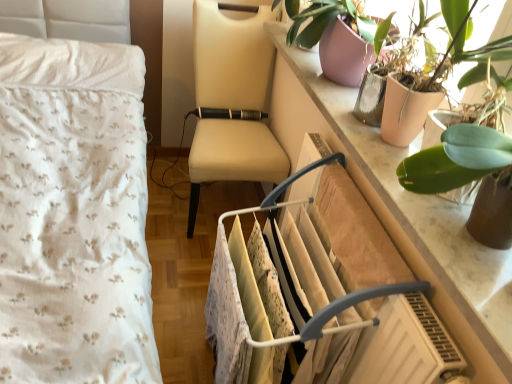
Question: Is point (479, 278) closer or farther from the camera than point (216, 370)?

Choices:
 (A) closer
 (B) farther

Answer: (A)

Question: Considering the relative positions of marble counter top at upper right and white plastic clothes rack at center in the image provided, is marble counter top at upper right to the left or to the right of white plastic clothes rack at center?

Choices:
 (A) right
 (B) left

Answer: (A)

Question: Which object is positioned closest to the beige leather chair at center?

Choices:
 (A) white plastic clothes rack at center
 (B) matte pink pot at upper right, placed as the first houseplant when sorted from back to front
 (C) marble counter top at upper right
 (D) green leafy plant at upper right, which appears as the 2th houseplant when viewed from the back

Answer: (C)

Question: Which object is positioned closest to the white plastic clothes rack at center?

Choices:
 (A) green leafy plant at upper right, the first houseplant in the front-to-back sequence
 (B) marble counter top at upper right
 (C) beige leather chair at center
 (D) matte pink pot at upper right, placed as the first houseplant when sorted from back to front

Answer: (B)